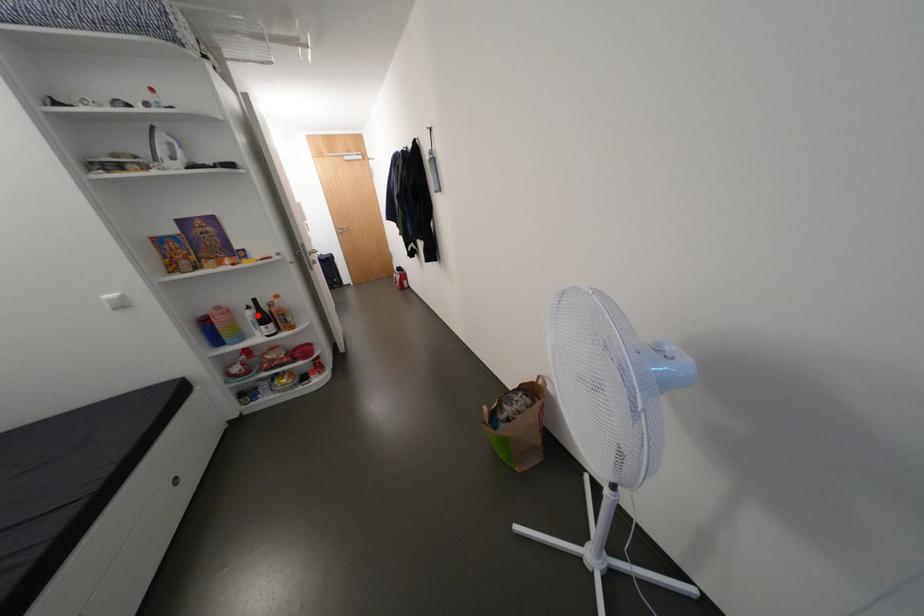
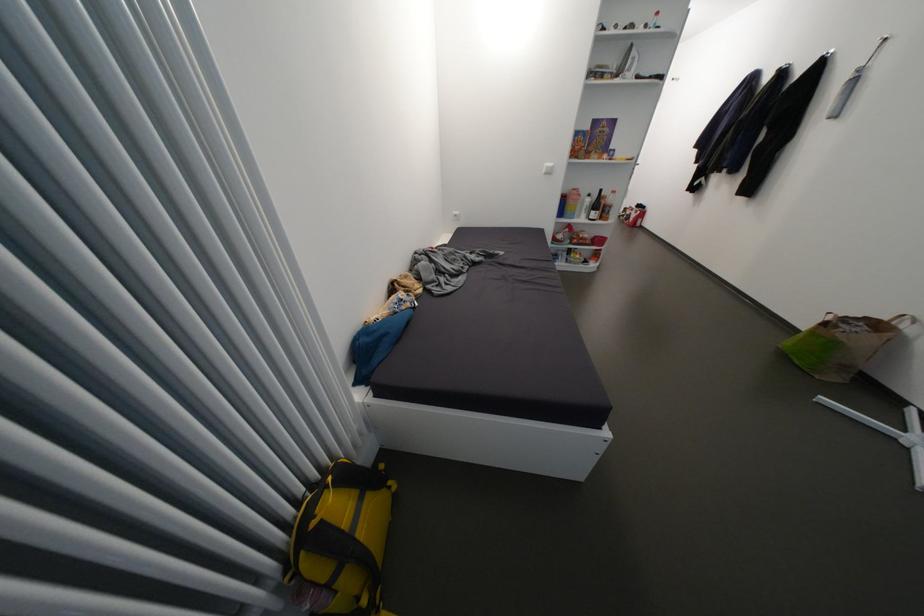
The point at the highlighted location is marked in the first image. Where is the corresponding point in the second image?

(596, 201)